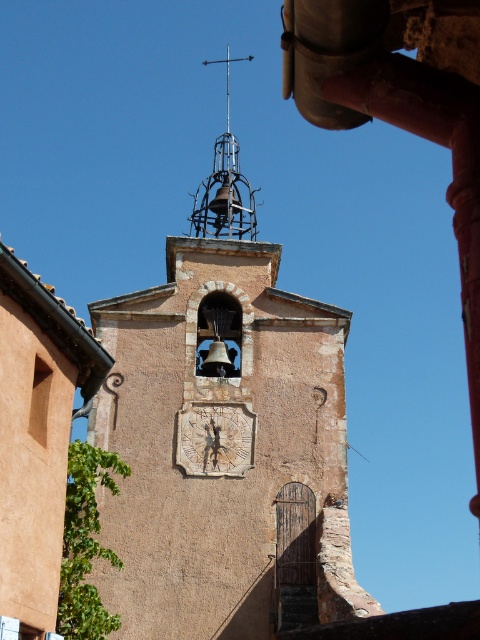
You are an architect examining the historic building. You notice the brown textured stone clock tower at center and the metallic bell tower at upper center. Which structure is taller?

The metallic bell tower at upper center is taller than the brown textured stone clock tower at center.

You are an architect inspecting the bell tower. You notice the white textured clock at center and the metallic bell tower at upper center. Which object is larger in size?

The metallic bell tower at upper center is larger in size than the white textured clock at center.